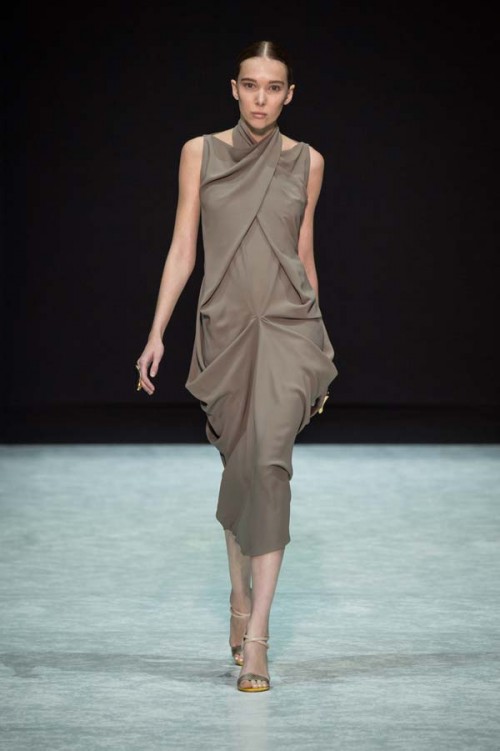
Locate an element on the screen. floor is located at coordinates (135, 546).